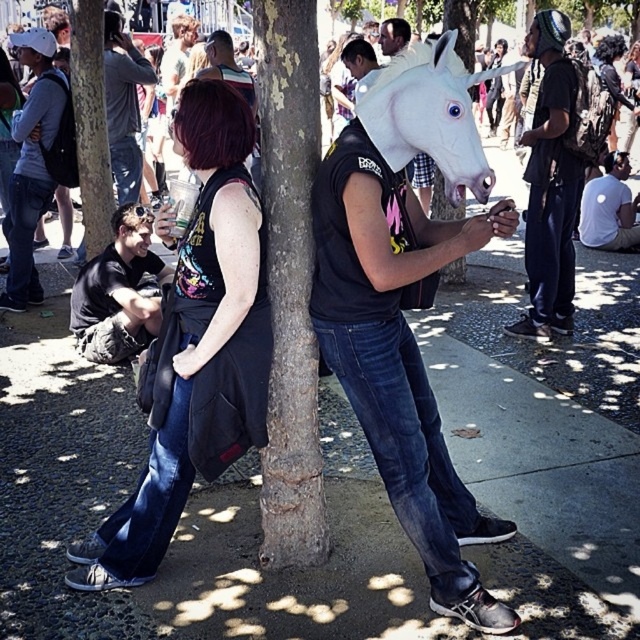
Question: Among these points, which one is nearest to the camera?

Choices:
 (A) (99, 221)
 (B) (173, 20)

Answer: (A)

Question: Based on their relative distances, which object is farther from the green bark tree at center?

Choices:
 (A) white matte t-shirt at lower right
 (B) vivid purple hair at center

Answer: (A)

Question: Is brown rough bark tree at center above green bark tree at center?

Choices:
 (A) yes
 (B) no

Answer: (B)

Question: Is white matte unicorn mask at center below shiny gold hair at upper center?

Choices:
 (A) no
 (B) yes

Answer: (B)

Question: In this image, where is white matte unicorn head at center located relative to matte black mask at center?

Choices:
 (A) left
 (B) right

Answer: (B)

Question: Which point is farther to the camera?

Choices:
 (A) matte black mask at center
 (B) white matte unicorn head at center
 (C) black matte mask at upper right

Answer: (A)